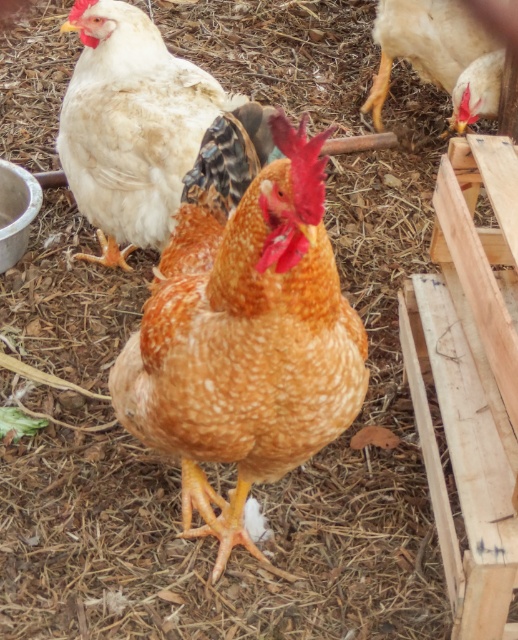
In the chicken coop scene, there is a speckled feathered chicken at center and a white fluffy chicken at upper left. Which chicken is positioned lower in the image?

The speckled feathered chicken at center is positioned lower than the white fluffy chicken at upper left.